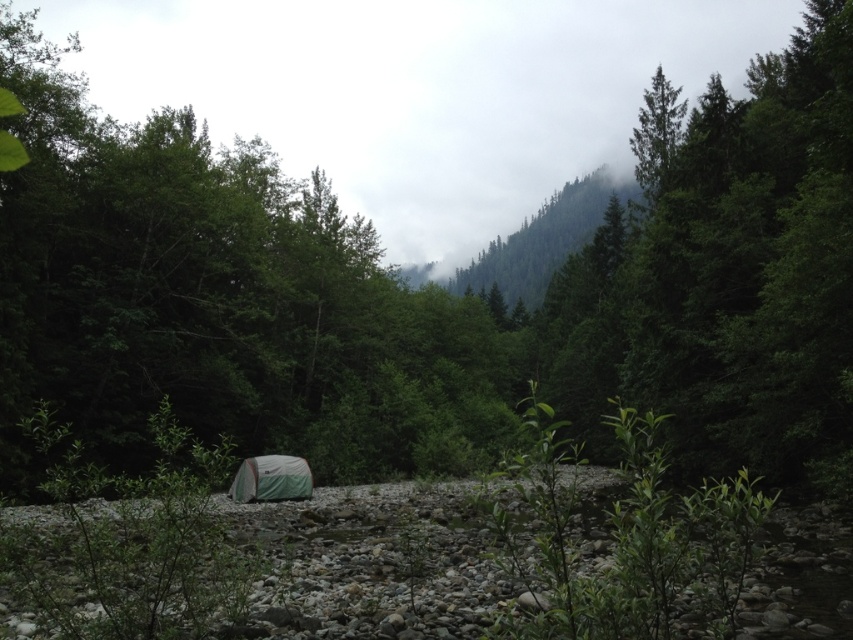
Does green needle-like tree at upper right have a lesser width compared to white fabric tent at center?

No.

Which of these two, green needle-like tree at upper right or white fabric tent at center, stands shorter?

Standing shorter between the two is white fabric tent at center.

Is point (647, 195) behind point (277, 499)?

That is True.

Locate an element on the screen. The width and height of the screenshot is (853, 640). green needle-like tree at upper right is located at coordinates (656, 134).